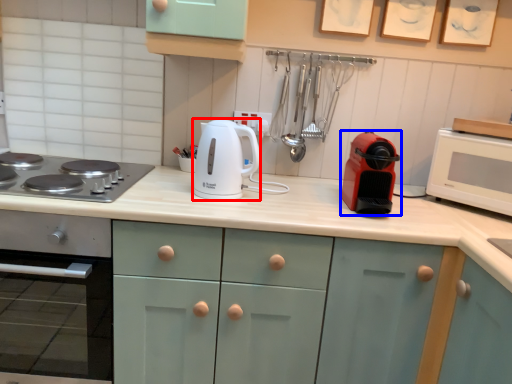
Question: Which point is closer to the camera, kitchen appliance (highlighted by a red box) or kitchen appliance (highlighted by a blue box)?

Choices:
 (A) kitchen appliance
 (B) kitchen appliance

Answer: (B)